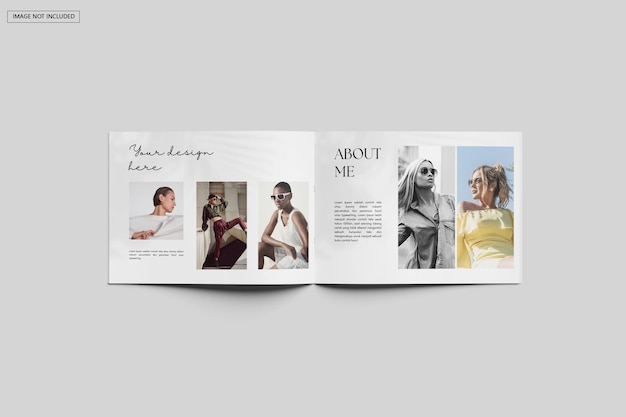
Locate an element on the screen. black & white photograph is located at coordinates (431, 192).